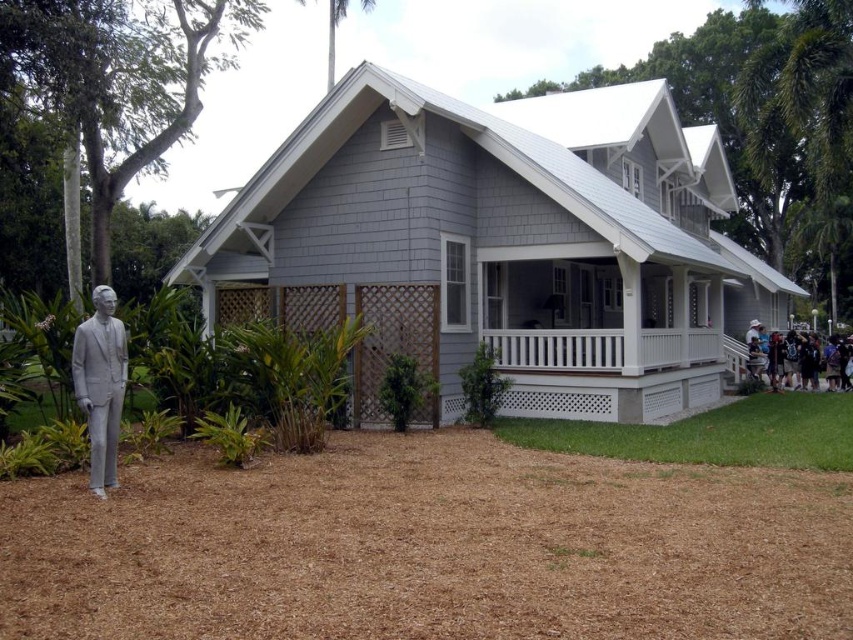
Is white painted wood porch at center positioned in front of white cotton shirt at lower right?

Yes, white painted wood porch at center is closer to the viewer.

At what (x,y) coordinates should I click in order to perform the action: click on white painted wood porch at center. Please return your answer as a coordinate pair (x, y). The image size is (853, 640). Looking at the image, I should click on (602, 348).

This screenshot has height=640, width=853. In order to click on white painted wood porch at center in this screenshot , I will do `click(602, 348)`.

Is point (653, 340) farther from viewer compared to point (102, 497)?

That is True.

Who is lower down, white painted wood porch at center or white matte statue at lower left?

white matte statue at lower left is below.

Between point (598, 342) and point (93, 349), which one is positioned behind?

Point (598, 342)

The image size is (853, 640). In order to click on white painted wood porch at center in this screenshot , I will do `click(602, 348)`.

Does white matte statue at lower left have a greater width compared to white cotton shirt at lower right?

No.

The height and width of the screenshot is (640, 853). Describe the element at coordinates (100, 385) in the screenshot. I see `white matte statue at lower left` at that location.

This screenshot has height=640, width=853. Find the location of `white matte statue at lower left`. white matte statue at lower left is located at coordinates (100, 385).